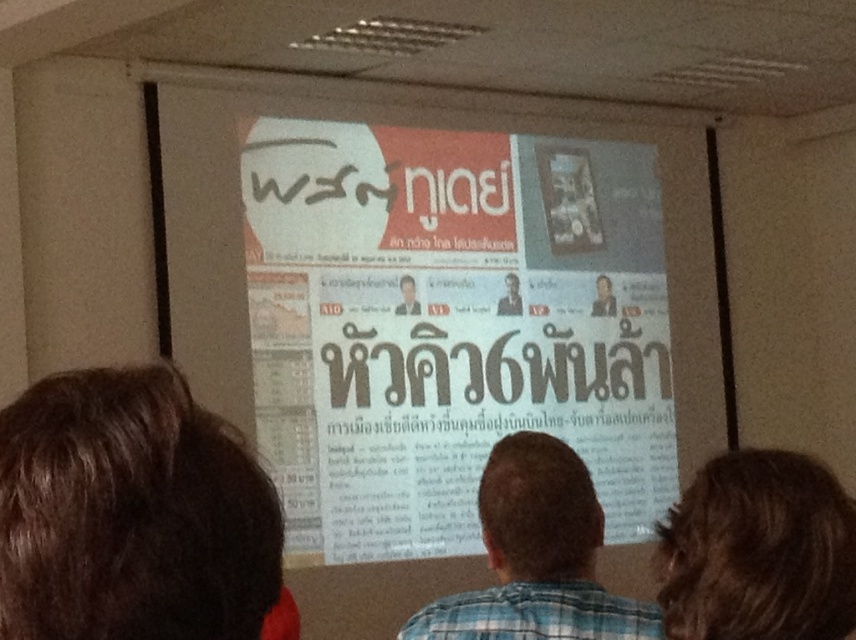
Question: Is blue plaid shirt at center positioned in front of smooth black portrait at center?

Choices:
 (A) no
 (B) yes

Answer: (B)

Question: Where is white paper poster at center located in relation to smooth skin face at center in the image?

Choices:
 (A) left
 (B) right

Answer: (A)

Question: Which point appears farthest from the camera in this image?

Choices:
 (A) (494, 589)
 (B) (513, 291)
 (C) (354, 280)
 (D) (397, 308)

Answer: (B)

Question: Estimate the real-world distances between objects in this image. Which object is farther from the blue plaid shirt at center?

Choices:
 (A) dark brown hair at lower right
 (B) smooth skin face at center
 (C) white paper poster at center

Answer: (B)

Question: Among these objects, which one is nearest to the camera?

Choices:
 (A) smooth black portrait at center
 (B) blue plaid shirt at center

Answer: (B)

Question: In this image, where is white paper poster at center located relative to smooth black portrait at center?

Choices:
 (A) above
 (B) below

Answer: (B)